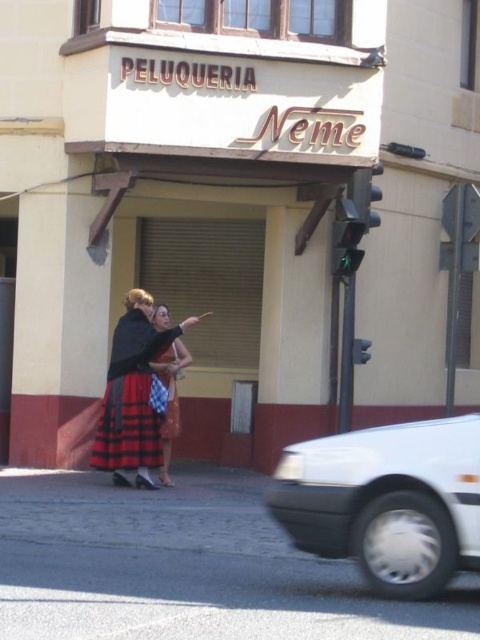
Question: Is red plaid skirt at center above plaid fabric dress at center?

Choices:
 (A) no
 (B) yes

Answer: (A)

Question: From the image, what is the correct spatial relationship of white matte car at lower right in relation to plaid fabric dress at center?

Choices:
 (A) below
 (B) above

Answer: (A)

Question: Based on their relative distances, which object is farther from the red plaid skirt at center?

Choices:
 (A) white matte car at lower right
 (B) plaid skirt at center
 (C) plaid fabric dress at center

Answer: (A)

Question: Is the position of white matte car at lower right less distant than that of plaid skirt at center?

Choices:
 (A) yes
 (B) no

Answer: (A)

Question: Which point is farther to the camera?

Choices:
 (A) [110, 426]
 (B) [176, 401]
 (C) [162, 381]
 (D) [455, 486]

Answer: (B)

Question: Based on their relative distances, which object is farther from the plaid skirt at center?

Choices:
 (A) red plaid skirt at center
 (B) white matte car at lower right
 (C) plaid fabric dress at center

Answer: (B)